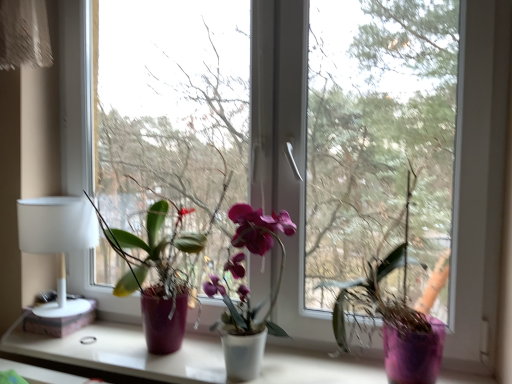
What do you see at coordinates (248, 293) in the screenshot?
I see `matte purple orchid at center, positioned as the second houseplant in left-to-right order` at bounding box center [248, 293].

The height and width of the screenshot is (384, 512). Describe the element at coordinates (127, 353) in the screenshot. I see `white matte window sill at center` at that location.

Based on the photo, measure the distance between point (326, 97) and camera.

The depth of point (326, 97) is 1.31 meters.

The image size is (512, 384). Describe the element at coordinates (380, 139) in the screenshot. I see `transparent glass window at center, which is counted as the 1th window screen, starting from the right` at that location.

In order to click on matte purple orchid at center, acting as the second houseplant starting from the right in this screenshot , I will do [248, 293].

I want to click on the 1st houseplant behind the purple matte vase at center, the 3th houseplant viewed from the left, counting from the anchor's position, so click(162, 268).

From the image's perspective, would you say purple matte vase at center, the 3th houseplant viewed from the left, is positioned over matte purple pot at left, the third houseplant positioned from the right?

Indeed, from the image's perspective, purple matte vase at center, the 3th houseplant viewed from the left, is shown above matte purple pot at left, the third houseplant positioned from the right.

Do you think purple matte vase at center, placed as the 1th houseplant when sorted from right to left, is within matte purple pot at left, the third houseplant positioned from the right, or outside of it?

The correct answer is: outside.

Considering the sizes of objects purple matte vase at center, placed as the 1th houseplant when sorted from right to left, and matte purple pot at left, the 1th houseplant from the left, in the image provided, who is thinner, purple matte vase at center, placed as the 1th houseplant when sorted from right to left, or matte purple pot at left, the 1th houseplant from the left,?

purple matte vase at center, placed as the 1th houseplant when sorted from right to left.

Which object is positioned more to the left, matte purple pot at left, the 1th houseplant from the left, or purple matte vase at center, placed as the 1th houseplant when sorted from right to left?

matte purple pot at left, the 1th houseplant from the left, is more to the left.

Could you tell me if matte purple pot at left, the third houseplant positioned from the right, is facing purple matte vase at center, the 3th houseplant viewed from the left?

No, matte purple pot at left, the third houseplant positioned from the right, is not facing towards purple matte vase at center, the 3th houseplant viewed from the left.

Considering the sizes of objects matte purple pot at left, the 1th houseplant from the left, and purple matte vase at center, placed as the 1th houseplant when sorted from right to left, in the image provided, who is thinner, matte purple pot at left, the 1th houseplant from the left, or purple matte vase at center, placed as the 1th houseplant when sorted from right to left,?

With smaller width is purple matte vase at center, placed as the 1th houseplant when sorted from right to left.

Where is `the 2nd houseplant to the left when counting from the purple matte vase at center, placed as the 1th houseplant when sorted from right to left`? the 2nd houseplant to the left when counting from the purple matte vase at center, placed as the 1th houseplant when sorted from right to left is located at coordinates (162, 268).

Can you see matte purple orchid at center, acting as the second houseplant starting from the right, touching white matte window sill at center?

No, matte purple orchid at center, acting as the second houseplant starting from the right, is not with white matte window sill at center.

Can you tell me how much matte purple orchid at center, positioned as the second houseplant in left-to-right order, and white matte window sill at center differ in facing direction?

The angle between the facing direction of matte purple orchid at center, positioned as the second houseplant in left-to-right order, and the facing direction of white matte window sill at center is 1.06 degrees.

Considering their positions, is matte purple orchid at center, acting as the second houseplant starting from the right, located in front of or behind white matte window sill at center?

Visually, matte purple orchid at center, acting as the second houseplant starting from the right, is located behind white matte window sill at center.

Is matte purple orchid at center, acting as the second houseplant starting from the right, not within white matte window sill at center?

Indeed, matte purple orchid at center, acting as the second houseplant starting from the right, is completely outside white matte window sill at center.

In order to click on window screen below the transparent glass window at center, placed as the 2th window screen when sorted from right to left (from the image's perspective) in this screenshot , I will do `click(380, 139)`.

In terms of size, does transparent glass window at center, placed as the 2th window screen when sorted from right to left, appear bigger or smaller than transparent glass window at center, which is counted as the 1th window screen, starting from the right?

In the image, transparent glass window at center, placed as the 2th window screen when sorted from right to left, appears to be smaller than transparent glass window at center, which is counted as the 1th window screen, starting from the right.

Which is less distant, (185,170) or (442,134)?

Point (185,170).

Consider the image. From the image's perspective, is transparent glass window at center, which is counted as the 1th window screen, starting from the left, below transparent glass window at center, which is counted as the 1th window screen, starting from the right?

No.

From the image's perspective, does transparent glass window at center, placed as the 2th window screen when sorted from right to left, appear higher than white matte window sill at center?

Yes, from the image's perspective, transparent glass window at center, placed as the 2th window screen when sorted from right to left, is above white matte window sill at center.

Considering the relative sizes of transparent glass window at center, which is counted as the 1th window screen, starting from the left, and white matte window sill at center in the image provided, is transparent glass window at center, which is counted as the 1th window screen, starting from the left, bigger than white matte window sill at center?

Correct, transparent glass window at center, which is counted as the 1th window screen, starting from the left, is larger in size than white matte window sill at center.

Which of these two, transparent glass window at center, placed as the 2th window screen when sorted from right to left, or white matte window sill at center, stands taller?

With more height is transparent glass window at center, placed as the 2th window screen when sorted from right to left.

Is transparent glass window at center, placed as the 2th window screen when sorted from right to left, thinner than white matte window sill at center?

Yes.

Is matte purple orchid at center, positioned as the second houseplant in left-to-right order, facing towards transparent glass window at center?

No, matte purple orchid at center, positioned as the second houseplant in left-to-right order, is not aimed at transparent glass window at center.

Which point is more forward, (x=263, y=318) or (x=331, y=231)?

The point (x=331, y=231) is closer to the camera.

Which object is more forward, matte purple orchid at center, acting as the second houseplant starting from the right, or transparent glass window at center?

transparent glass window at center is in front.

Is matte purple orchid at center, acting as the second houseplant starting from the right, situated inside transparent glass window at center or outside?

The correct answer is: outside.

Based on the photo, which of these two, purple matte vase at center, placed as the 1th houseplant when sorted from right to left, or white matte table lamp at left, stands taller?

Standing taller between the two is purple matte vase at center, placed as the 1th houseplant when sorted from right to left.

From the image's perspective, is purple matte vase at center, placed as the 1th houseplant when sorted from right to left, on top of white matte table lamp at left?

Indeed, from the image's perspective, purple matte vase at center, placed as the 1th houseplant when sorted from right to left, is shown above white matte table lamp at left.

Is purple matte vase at center, the 3th houseplant viewed from the left, to the left or to the right of white matte table lamp at left in the image?

Based on their positions, purple matte vase at center, the 3th houseplant viewed from the left, is located to the right of white matte table lamp at left.

Can you confirm if purple matte vase at center, the 3th houseplant viewed from the left, is wider than white matte table lamp at left?

Incorrect, the width of purple matte vase at center, the 3th houseplant viewed from the left, does not surpass that of white matte table lamp at left.

Which houseplant is the 1st one when counting from the back of the purple matte vase at center, placed as the 1th houseplant when sorted from right to left? Please provide its 2D coordinates.

[(162, 268)]

I want to click on the 1st houseplant directly beneath the purple matte vase at center, the 3th houseplant viewed from the left (from a real-world perspective), so click(x=162, y=268).

Considering their positions, is matte purple pot at left, the third houseplant positioned from the right, positioned further to matte purple orchid at center, acting as the second houseplant starting from the right, than transparent glass window at center, placed as the 2th window screen when sorted from right to left?

transparent glass window at center, placed as the 2th window screen when sorted from right to left, is further to matte purple orchid at center, acting as the second houseplant starting from the right.

When comparing their distances from white matte table lamp at left, does transparent glass window at center, which is counted as the 1th window screen, starting from the left, or matte purple orchid at center, positioned as the second houseplant in left-to-right order, seem further?

transparent glass window at center, which is counted as the 1th window screen, starting from the left, is positioned further to the anchor white matte table lamp at left.

Looking at the image, which one is located closer to white matte table lamp at left, white matte window sill at center or matte purple orchid at center, positioned as the second houseplant in left-to-right order?

white matte window sill at center lies closer to white matte table lamp at left than the other object.

Looking at the image, which one is located closer to matte purple pot at left, the third houseplant positioned from the right, purple matte vase at center, placed as the 1th houseplant when sorted from right to left, or matte purple orchid at center, acting as the second houseplant starting from the right?

The object closer to matte purple pot at left, the third houseplant positioned from the right, is matte purple orchid at center, acting as the second houseplant starting from the right.

From the image, which object appears to be nearer to transparent glass window at center, white matte window sill at center or transparent glass window at center, placed as the second window screen when sorted from left to right?

Among the two, transparent glass window at center, placed as the second window screen when sorted from left to right, is located nearer to transparent glass window at center.

Looking at the image, which one is located further to white matte window sill at center, matte purple orchid at center, acting as the second houseplant starting from the right, or transparent glass window at center, which is counted as the 1th window screen, starting from the left?

Based on the image, transparent glass window at center, which is counted as the 1th window screen, starting from the left, appears to be further to white matte window sill at center.

When comparing their distances from transparent glass window at center, which is counted as the 1th window screen, starting from the left, does matte purple pot at left, the 1th houseplant from the left, or transparent glass window at center seem further?

matte purple pot at left, the 1th houseplant from the left, lies further to transparent glass window at center, which is counted as the 1th window screen, starting from the left, than the other object.

Considering their positions, is transparent glass window at center positioned further to transparent glass window at center, placed as the 2th window screen when sorted from right to left, than matte purple orchid at center, positioned as the second houseplant in left-to-right order?

The object further to transparent glass window at center, placed as the 2th window screen when sorted from right to left, is matte purple orchid at center, positioned as the second houseplant in left-to-right order.

This screenshot has width=512, height=384. In order to click on window between matte purple pot at left, the third houseplant positioned from the right, and purple matte vase at center, the 3th houseplant viewed from the left, in the horizontal direction in this screenshot , I will do `click(289, 133)`.

At what (x,y) coordinates should I click in order to perform the action: click on houseplant situated between white matte table lamp at left and matte purple orchid at center, positioned as the second houseplant in left-to-right order, from left to right. Please return your answer as a coordinate pair (x, y). Looking at the image, I should click on (162, 268).

This screenshot has height=384, width=512. Find the location of `window located between white matte table lamp at left and matte purple orchid at center, acting as the second houseplant starting from the right, in the left-right direction`. window located between white matte table lamp at left and matte purple orchid at center, acting as the second houseplant starting from the right, in the left-right direction is located at coordinates (289, 133).

At what (x,y) coordinates should I click in order to perform the action: click on houseplant between white matte table lamp at left and white matte window sill at center. Please return your answer as a coordinate pair (x, y). This screenshot has height=384, width=512. Looking at the image, I should click on pos(162,268).